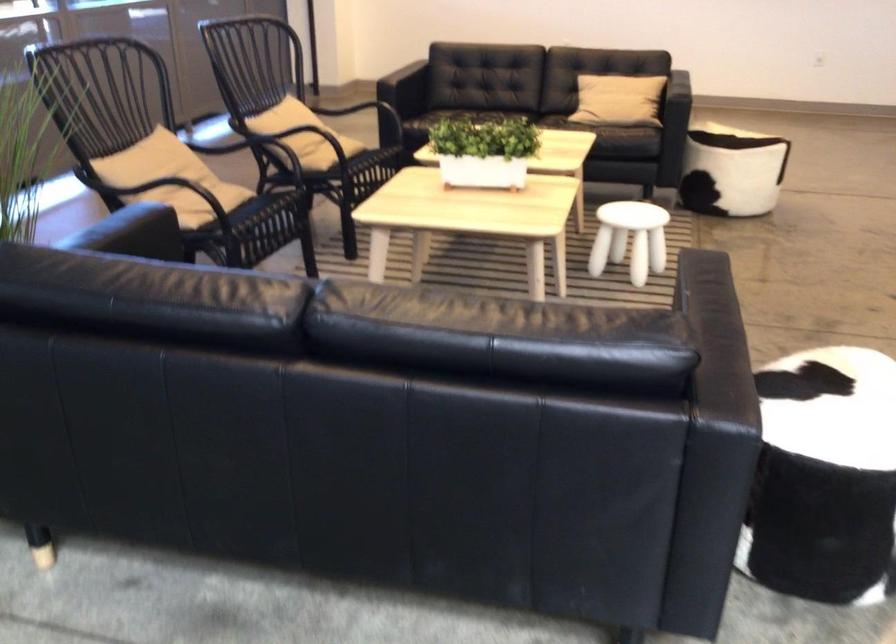
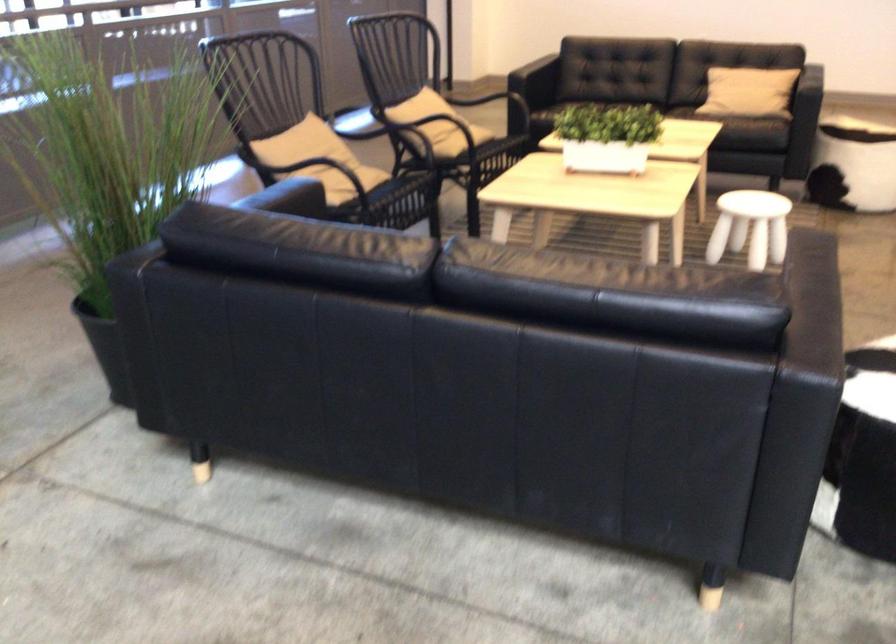
In the second image, find the point that corresponds to pixel 717 167 in the first image.

(854, 161)